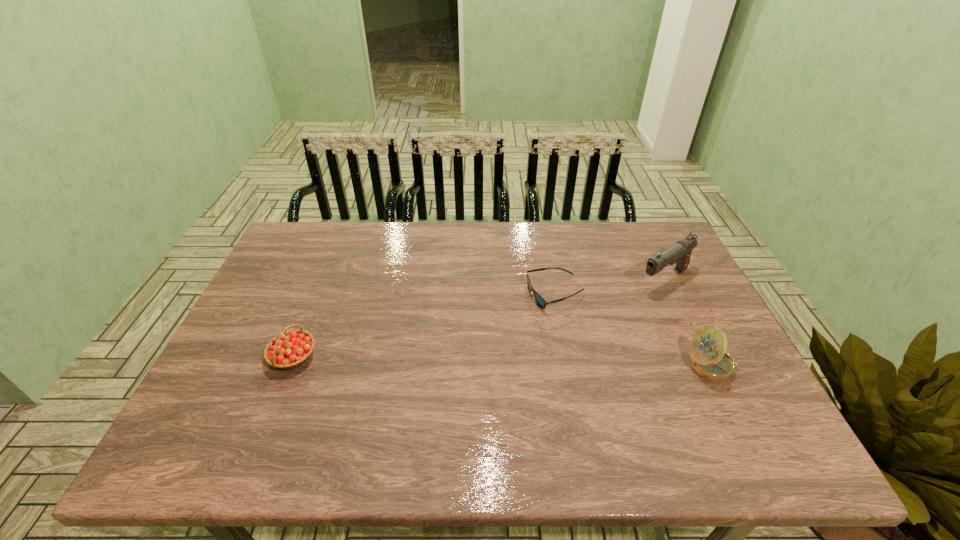
I want to click on vacant region that satisfies the following two spatial constraints: 1. on the front side of the sunglasses; 2. with the dial facing the second tallest object, so click(568, 366).

You are a GUI agent. You are given a task and a screenshot of the screen. Output one action in this format:
    pyautogui.click(x=<x>, y=<y>)
    Task: Click on the free region that satisfies the following two spatial constraints: 1. on the back side of the leftmost object; 2. on the left side of the gun
    
    Given the screenshot: What is the action you would take?
    coord(324,280)